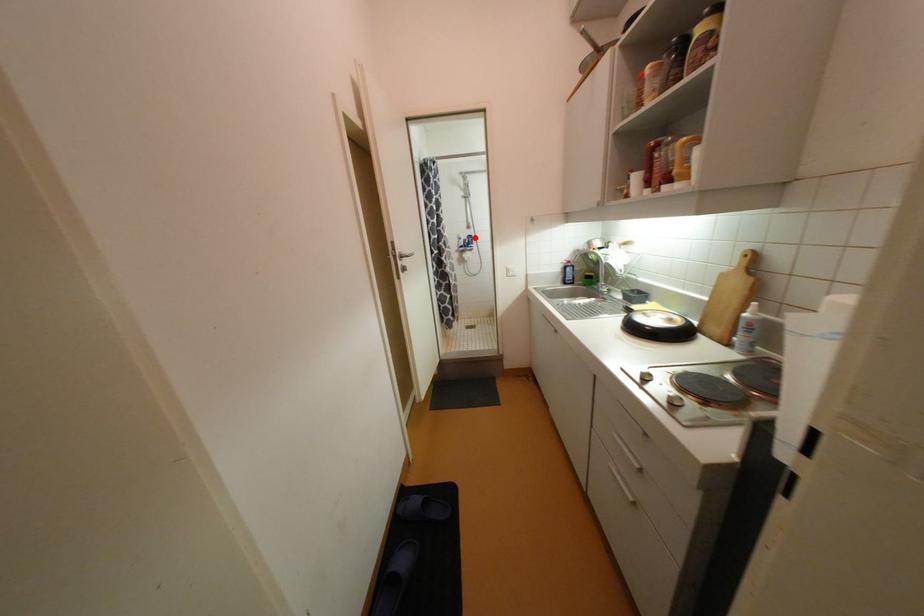
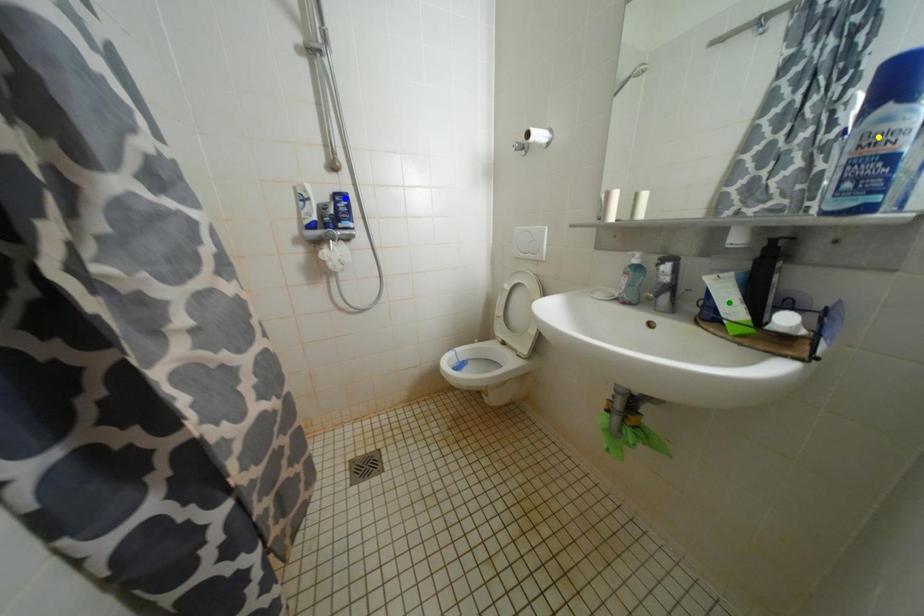
Question: I am providing you with two images of the same scene from different viewpoints. A red point is marked on the first image. You are given multiple points on the second image. Which spot in image 2 lines up with the point in image 1?

Choices:
 (A) green point
 (B) blue point
 (C) yellow point

Answer: (B)